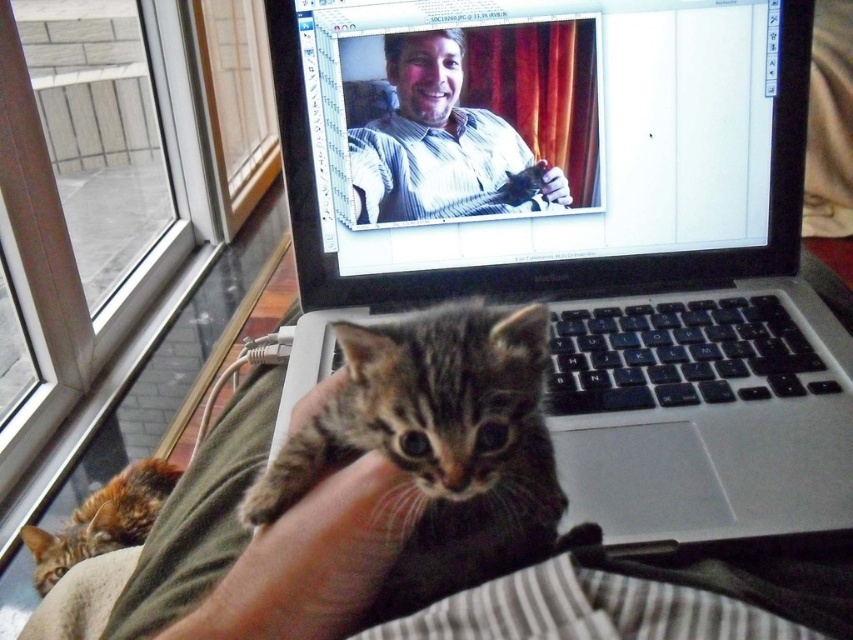
Consider the image. Can you confirm if matte plastic laptop at center is wider than fluffy gray kitten at center?

No.

Looking at this image, who is shorter, matte plastic laptop at center or fluffy gray kitten at center?

matte plastic laptop at center is shorter.

Identify the location of matte plastic laptop at center. This screenshot has width=853, height=640. (544, 128).

Image resolution: width=853 pixels, height=640 pixels. In order to click on matte plastic laptop at center in this screenshot , I will do `click(544, 128)`.

Does point (549, 493) come in front of point (757, 552)?

Yes, point (549, 493) is in front of point (757, 552).

Between point (479, 339) and point (846, 582), which one is positioned behind?

Point (846, 582)

Measure the distance between tabby fur kitten at center and camera.

tabby fur kitten at center and camera are 12.36 inches apart.

The height and width of the screenshot is (640, 853). I want to click on tabby fur kitten at center, so click(438, 444).

Is matte plastic laptop at center further to camera compared to tabby fur kitten at center?

Answer: Yes, matte plastic laptop at center is behind tabby fur kitten at center.

Does matte plastic laptop at center appear over tabby fur kitten at center?

Yes.

What are the coordinates of `matte plastic laptop at center` in the screenshot? It's located at (544, 128).